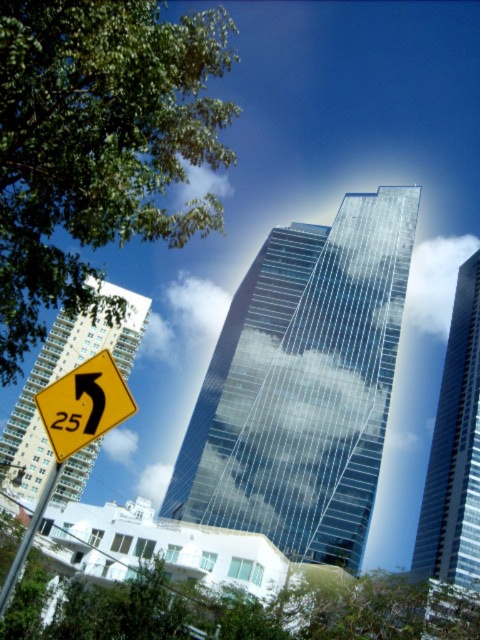
Which is in front, point (43, 406) or point (34, 522)?

Point (34, 522) is more forward.

Is the position of yellow plastic sign at lower left more distant than that of metallic pole at lower left?

No, yellow plastic sign at lower left is in front of metallic pole at lower left.

Is point (112, 356) farther from viewer compared to point (37, 515)?

Yes, point (112, 356) is behind point (37, 515).

Locate an element on the screen. The height and width of the screenshot is (640, 480). yellow plastic sign at lower left is located at coordinates click(x=84, y=404).

Is green leafy tree at upper left smaller than yellow plastic sign at lower left?

No, green leafy tree at upper left is not smaller than yellow plastic sign at lower left.

Which is in front, point (38, 276) or point (110, 403)?

Point (110, 403)

Is point (167, 120) closer to camera compared to point (60, 442)?

No, it is not.

Image resolution: width=480 pixels, height=640 pixels. Find the location of `green leafy tree at upper left`. green leafy tree at upper left is located at coordinates (97, 145).

How distant is green leafy tree at upper left from metallic pole at lower left?

green leafy tree at upper left and metallic pole at lower left are 21.17 meters apart from each other.

Is point (11, 285) less distant than point (13, 564)?

No, (11, 285) is further to viewer.

The width and height of the screenshot is (480, 640). I want to click on green leafy tree at upper left, so click(97, 145).